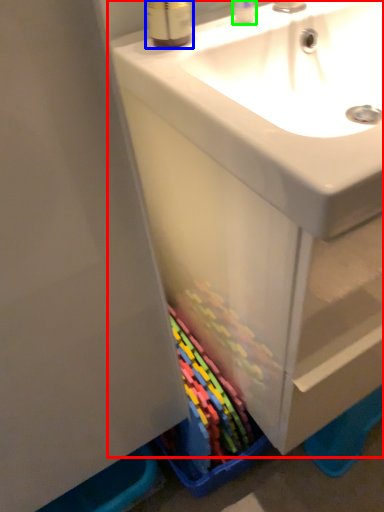
Question: Based on their relative distances, which object is nearer to bathroom cabinet (highlighted by a red box)? Choose from mouthwash (highlighted by a blue box) and toiletry (highlighted by a green box).

Choices:
 (A) mouthwash
 (B) toiletry

Answer: (A)